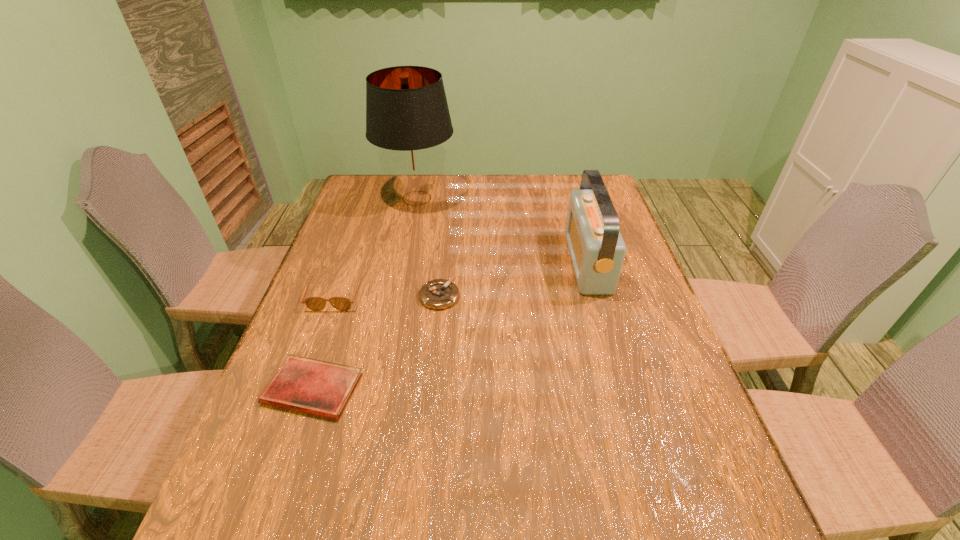
This screenshot has width=960, height=540. In order to click on the farthest object in this screenshot , I will do `click(407, 115)`.

Where is `the tallest object`? The width and height of the screenshot is (960, 540). the tallest object is located at coordinates (407, 115).

The height and width of the screenshot is (540, 960). I want to click on radio receiver, so click(x=597, y=250).

The width and height of the screenshot is (960, 540). I want to click on the fourth shortest object, so coord(597,250).

The width and height of the screenshot is (960, 540). I want to click on sunglasses, so click(x=313, y=303).

What are the coordinates of `ashtray` in the screenshot? It's located at (438, 294).

The height and width of the screenshot is (540, 960). In order to click on the shortest object in this screenshot , I will do `click(310, 386)`.

At what (x,y) coordinates should I click in order to perform the action: click on the nearest object. Please return your answer as a coordinate pair (x, y). Looking at the image, I should click on coord(310,386).

This screenshot has width=960, height=540. In order to click on free space located on the left of the lampshade in this screenshot , I will do `click(349, 198)`.

The height and width of the screenshot is (540, 960). Find the location of `free space located on the front-facing side of the fourth shortest object`. free space located on the front-facing side of the fourth shortest object is located at coordinates (499, 262).